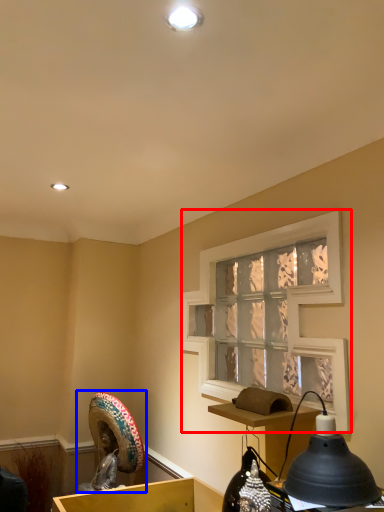
Question: Which point is further to the camera, window screen (highlighted by a red box) or sculpture (highlighted by a blue box)?

Choices:
 (A) window screen
 (B) sculpture

Answer: (B)